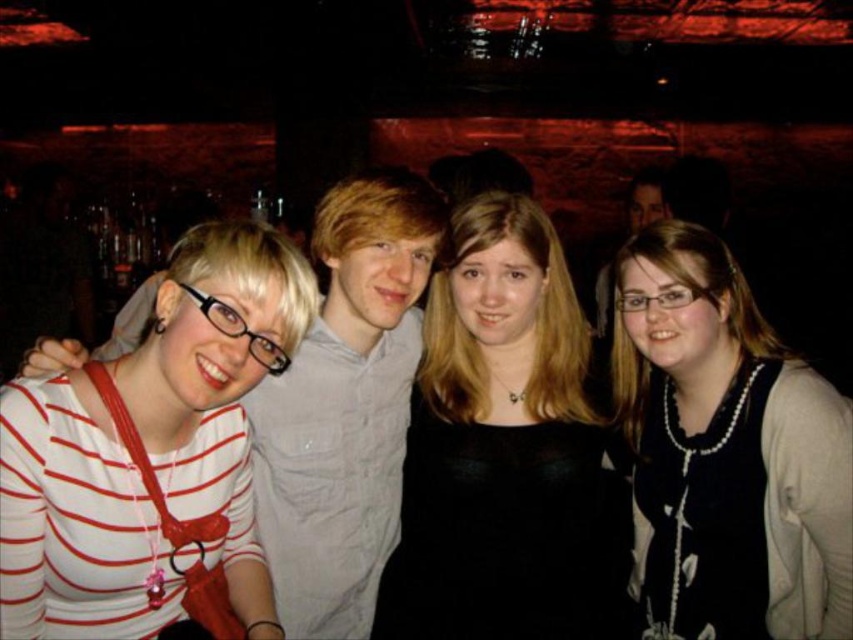
Can you confirm if black matte dress at center is positioned to the right of pearl necklace at center?

In fact, black matte dress at center is to the left of pearl necklace at center.

Who is more forward, [595,500] or [751,332]?

Point [751,332]

Find the location of `black matte dress at center`. black matte dress at center is located at coordinates (505, 451).

Between pearl necklace at center and white striped shirt at left, which one appears on the left side from the viewer's perspective?

From the viewer's perspective, white striped shirt at left appears more on the left side.

The width and height of the screenshot is (853, 640). I want to click on pearl necklace at center, so click(727, 451).

At what (x,y) coordinates should I click in order to perform the action: click on pearl necklace at center. Please return your answer as a coordinate pair (x, y). This screenshot has height=640, width=853. Looking at the image, I should click on (727, 451).

Is black matte dress at center taller than white striped shirt at left?

Correct, black matte dress at center is much taller as white striped shirt at left.

Is black matte dress at center positioned behind white striped shirt at left?

Yes.

Does point (606, 556) come closer to viewer compared to point (0, 497)?

No, (606, 556) is further to viewer.

The height and width of the screenshot is (640, 853). In order to click on black matte dress at center in this screenshot , I will do `click(505, 451)`.